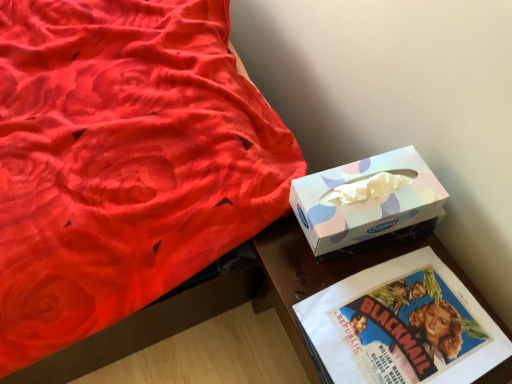
Question: From the image's perspective, is velvet red bed at upper left above or below pastel paper tissue box at right?

Choices:
 (A) below
 (B) above

Answer: (B)

Question: Considering the positions of velvet red bed at upper left and pastel paper tissue box at right in the image, is velvet red bed at upper left bigger or smaller than pastel paper tissue box at right?

Choices:
 (A) big
 (B) small

Answer: (A)

Question: Estimate the real-world distances between objects in this image. Which object is closer to the velvet red bed at upper left?

Choices:
 (A) pastel paper tissue box at right
 (B) wooden glossy table at lower right

Answer: (B)

Question: Which object is positioned closest to the wooden glossy table at lower right?

Choices:
 (A) velvet red bed at upper left
 (B) pastel paper tissue box at right

Answer: (B)